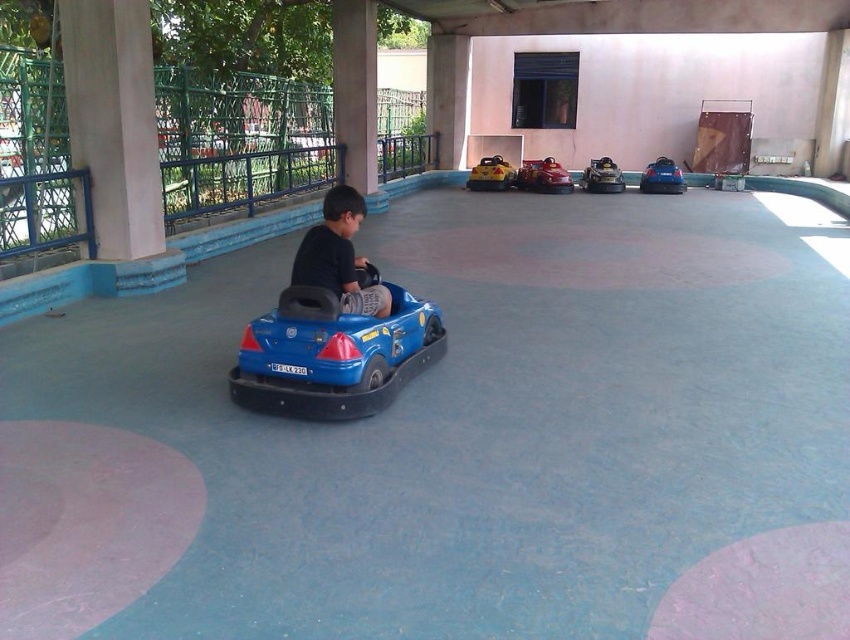
You are a parent supervising children at the amusement park. You notice a blue plastic toy car at center and a blue matte bumper car at center. Which one is wider?

The blue plastic toy car at center might be wider than blue matte bumper car at center according to the description.

You are a parent supervising children in the amusement park. You notice a blue plastic toy car at center and a matte black car at center. Which car is closer to the ground?

The blue plastic toy car at center is closer to the ground because it is located below the matte black car at center.

You are a parent supervising children at the amusement park. You see a yellow matte toy car at center and a metallic silver bumper car at center. Which one is more to the left?

The yellow matte toy car at center is more to the left because it is positioned on the left side of the metallic silver bumper car at center.